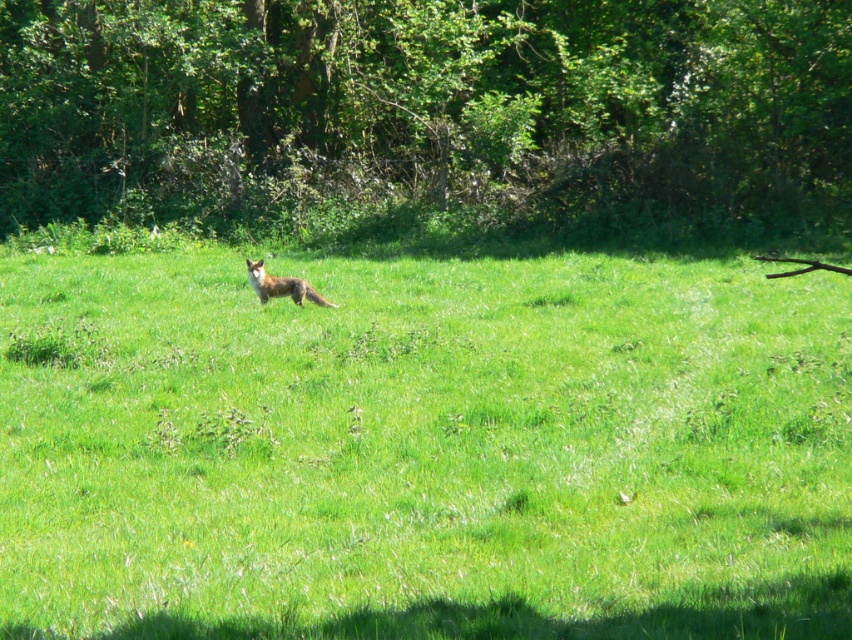
Question: Which of the following is the closest to the observer?

Choices:
 (A) (704, 474)
 (B) (79, 212)

Answer: (A)

Question: Can you confirm if green grassy field at center is thinner than reddish-brown fur fox at center?

Choices:
 (A) no
 (B) yes

Answer: (A)

Question: Is green grassy field at center above green leafy tree at center?

Choices:
 (A) no
 (B) yes

Answer: (A)

Question: Which object is positioned farthest from the reddish-brown fur fox at center?

Choices:
 (A) green grassy field at center
 (B) green leafy tree at center

Answer: (B)

Question: Which point is farther to the camera?

Choices:
 (A) green leafy tree at center
 (B) green grassy field at center
 (C) reddish-brown fur fox at center

Answer: (A)

Question: Can you confirm if green grassy field at center is wider than green leafy tree at center?

Choices:
 (A) no
 (B) yes

Answer: (A)